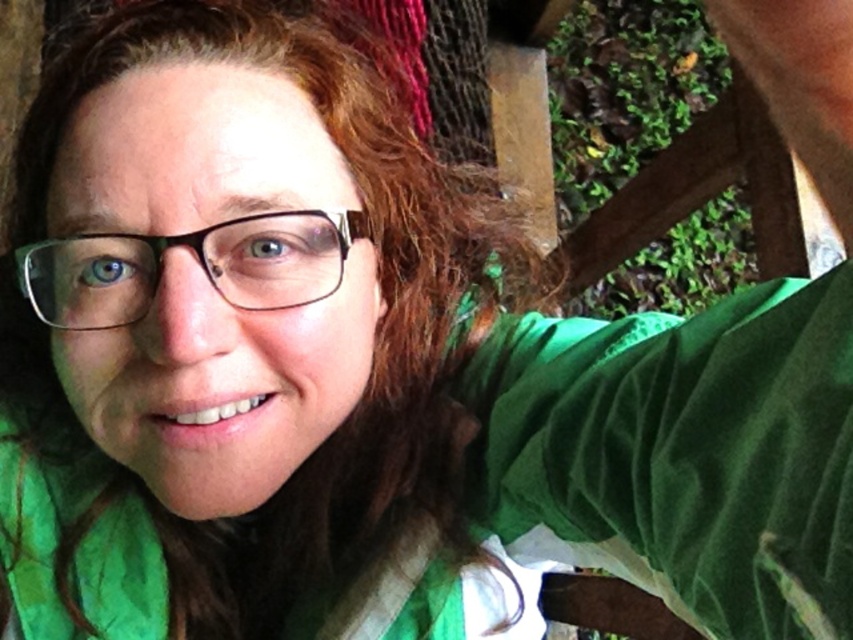
You are taking a photo and notice two points in the frame. One is at coordinate point (833, 220) and the other at point (80, 236). Which point is closer to the camera?

Point (833, 220) is in front of point (80, 236), so it is closer to the camera.

You are holding a camera and want to take a selfie. The camera is at point A and the person is at point B. The coordinates of point B are given as point B at (831,600). If the distance between point A and point B is 11.01 inches, can you estimate whether the camera is close enough to capture a clear selfie?

The distance between point A and point B at (831,600) is 11.01 inches. Since typical selfie distances are around 12 inches or closer for clarity, the camera is slightly too far away to capture a clear selfie.

You are analyzing a photo and notice a point at coordinates [265,355]. What object is located at this point?

The point at coordinates [265,355] has brownhair at center.